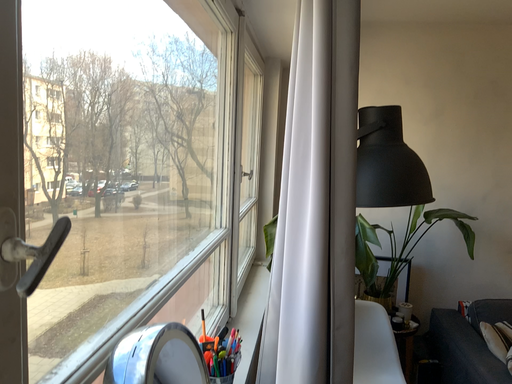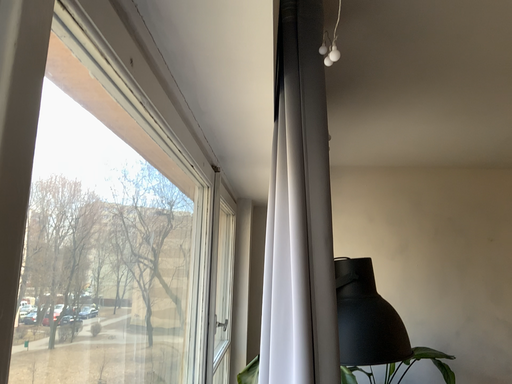
Question: Which way did the camera rotate in the video?

Choices:
 (A) rotated upward
 (B) rotated downward

Answer: (A)